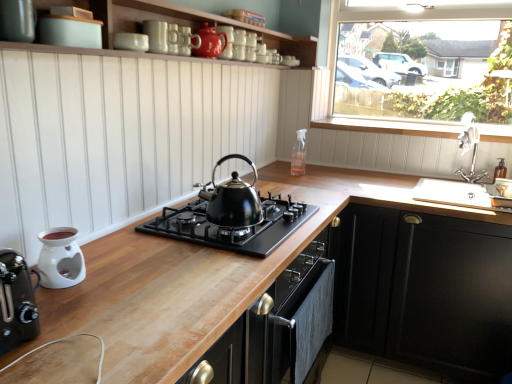
The image size is (512, 384). I want to click on vacant space to the right of clear glass spray bottle at upper center, the third appliance when ordered from top to bottom, so click(x=335, y=173).